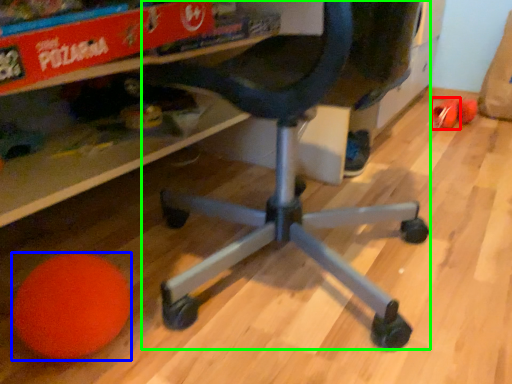
Question: Estimate the real-world distances between objects in this image. Which object is closer to toy (highlighted by a red box), ball (highlighted by a blue box) or computer chair (highlighted by a green box)?

Choices:
 (A) ball
 (B) computer chair

Answer: (B)